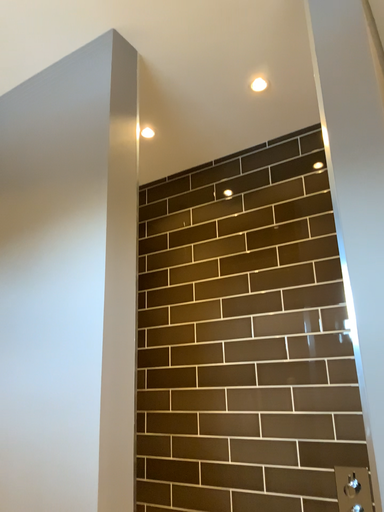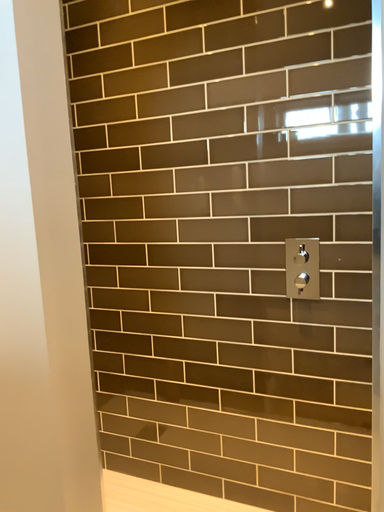
Question: How did the camera likely rotate when shooting the video?

Choices:
 (A) rotated left
 (B) rotated right

Answer: (B)